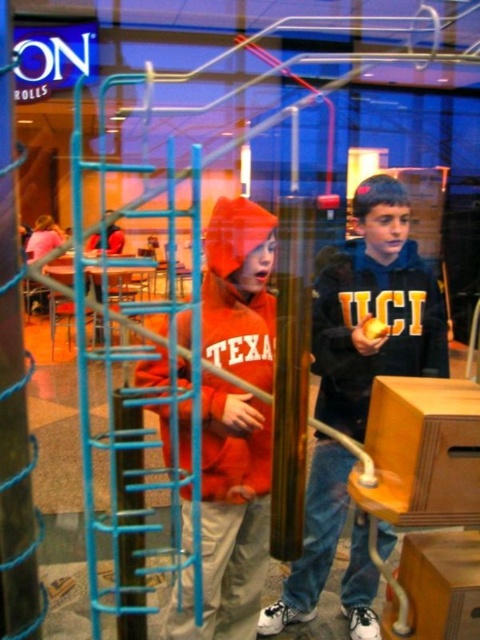
Does matte black hoodie at center have a greater width compared to orange fleece jacket at center?

Yes.

Which of these two, matte black hoodie at center or orange fleece jacket at center, stands shorter?

orange fleece jacket at center is shorter.

I want to click on matte black hoodie at center, so click(374, 308).

This screenshot has height=640, width=480. What are the coordinates of `matte black hoodie at center` in the screenshot? It's located at (374, 308).

Does orange fleece jacket at center appear under spiral blue plastic at center?

Yes, orange fleece jacket at center is below spiral blue plastic at center.

Which is more to the right, orange fleece jacket at center or spiral blue plastic at center?

orange fleece jacket at center is more to the right.

Who is more distant from viewer, (x=223, y=276) or (x=15, y=548)?

Positioned behind is point (x=223, y=276).

Identify the location of orange fleece jacket at center. The height and width of the screenshot is (640, 480). (239, 291).

Which is in front, point (424, 424) or point (41, 616)?

Point (424, 424) is in front.

Which is behind, point (435, 401) or point (10, 330)?

The point (435, 401) is behind.

Identify the location of wooden at center. Image resolution: width=480 pixels, height=640 pixels. (421, 452).